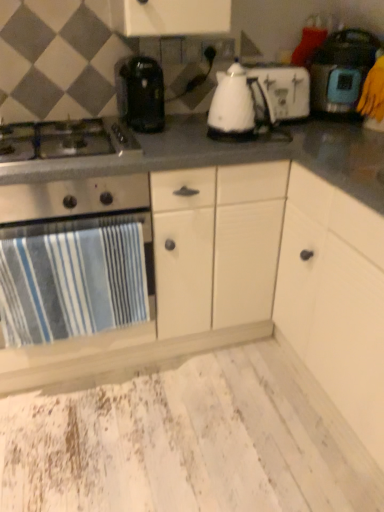
Question: From the image's perspective, is stainless steel gas stove at left on top of gray matte countertop at center?

Choices:
 (A) no
 (B) yes

Answer: (B)

Question: Can you confirm if stainless steel gas stove at left is positioned to the left of gray matte countertop at center?

Choices:
 (A) no
 (B) yes

Answer: (B)

Question: Does stainless steel gas stove at left have a greater width compared to gray matte countertop at center?

Choices:
 (A) no
 (B) yes

Answer: (A)

Question: Considering the relative sizes of stainless steel gas stove at left and gray matte countertop at center in the image provided, is stainless steel gas stove at left taller than gray matte countertop at center?

Choices:
 (A) yes
 (B) no

Answer: (B)

Question: Does stainless steel gas stove at left have a larger size compared to gray matte countertop at center?

Choices:
 (A) yes
 (B) no

Answer: (B)

Question: Considering the relative sizes of stainless steel gas stove at left and gray matte countertop at center in the image provided, is stainless steel gas stove at left smaller than gray matte countertop at center?

Choices:
 (A) yes
 (B) no

Answer: (A)

Question: Is gray matte countertop at center further to the viewer compared to matte black rice cooker at right, the 1th kitchen appliance in the right-to-left sequence?

Choices:
 (A) yes
 (B) no

Answer: (B)

Question: Is gray matte countertop at center closer to camera compared to matte black rice cooker at right, marked as the third kitchen appliance in a left-to-right arrangement?

Choices:
 (A) yes
 (B) no

Answer: (A)

Question: From the image's perspective, is gray matte countertop at center located above matte black rice cooker at right, the 1th kitchen appliance in the right-to-left sequence?

Choices:
 (A) no
 (B) yes

Answer: (A)

Question: Considering the relative sizes of gray matte countertop at center and matte black rice cooker at right, the 1th kitchen appliance in the right-to-left sequence, in the image provided, is gray matte countertop at center thinner than matte black rice cooker at right, the 1th kitchen appliance in the right-to-left sequence,?

Choices:
 (A) no
 (B) yes

Answer: (A)

Question: Could matte black rice cooker at right, marked as the third kitchen appliance in a left-to-right arrangement, be considered to be inside gray matte countertop at center?

Choices:
 (A) yes
 (B) no

Answer: (B)

Question: Does gray matte countertop at center have a greater height compared to matte black rice cooker at right, the 1th kitchen appliance in the right-to-left sequence?

Choices:
 (A) no
 (B) yes

Answer: (B)

Question: Considering the relative sizes of gray matte countertop at center and white plastic toaster at center, arranged as the 2th kitchen appliance when viewed from the right, in the image provided, is gray matte countertop at center smaller than white plastic toaster at center, arranged as the 2th kitchen appliance when viewed from the right,?

Choices:
 (A) no
 (B) yes

Answer: (A)